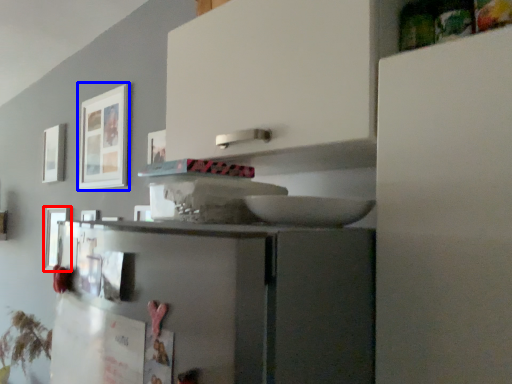
Question: Which object is further to the camera taking this photo, picture frame (highlighted by a red box) or picture frame (highlighted by a blue box)?

Choices:
 (A) picture frame
 (B) picture frame

Answer: (A)